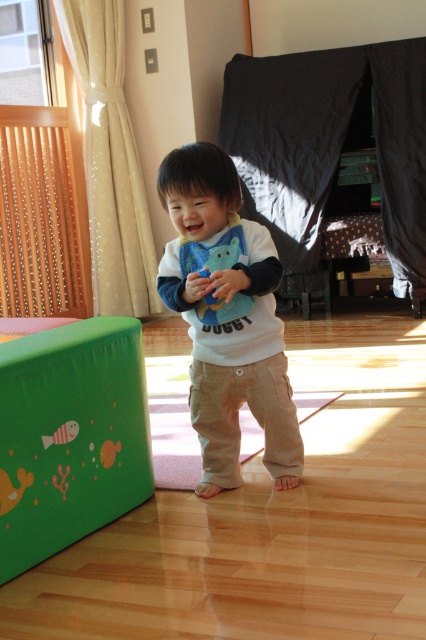
Question: Which object appears farthest from the camera in this image?

Choices:
 (A) green rubber play cube at lower left
 (B) matte white shirt at center

Answer: (B)

Question: Is green rubber play cube at lower left in front of matte white shirt at center?

Choices:
 (A) yes
 (B) no

Answer: (A)

Question: Can you confirm if green rubber play cube at lower left is thinner than matte white shirt at center?

Choices:
 (A) no
 (B) yes

Answer: (B)

Question: Which point is farther to the camera?

Choices:
 (A) green rubber play cube at lower left
 (B) matte white shirt at center

Answer: (B)

Question: Which point is farther to the camera?

Choices:
 (A) matte white shirt at center
 (B) green rubber play cube at lower left

Answer: (A)

Question: Does green rubber play cube at lower left have a larger size compared to matte white shirt at center?

Choices:
 (A) no
 (B) yes

Answer: (A)